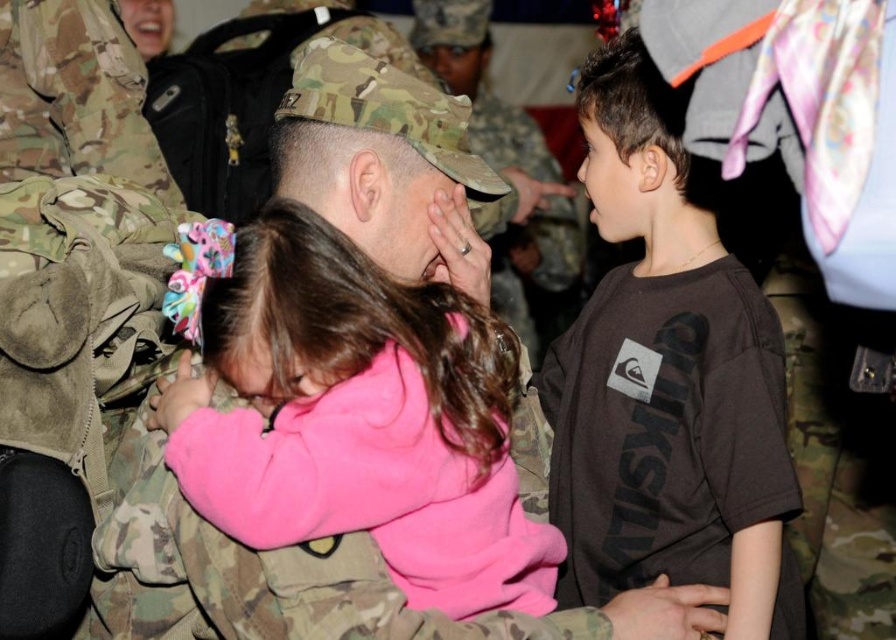
You are a photographer trying to capture a candid shot of the reunion scene. You notice the pink fleece at center and the matte camouflage forehead at center. Which object should you focus on if you want to capture the wider subject in your frame?

The pink fleece at center is wider than the matte camouflage forehead at center, so focusing on the pink fleece at center will capture the wider subject in your frame.